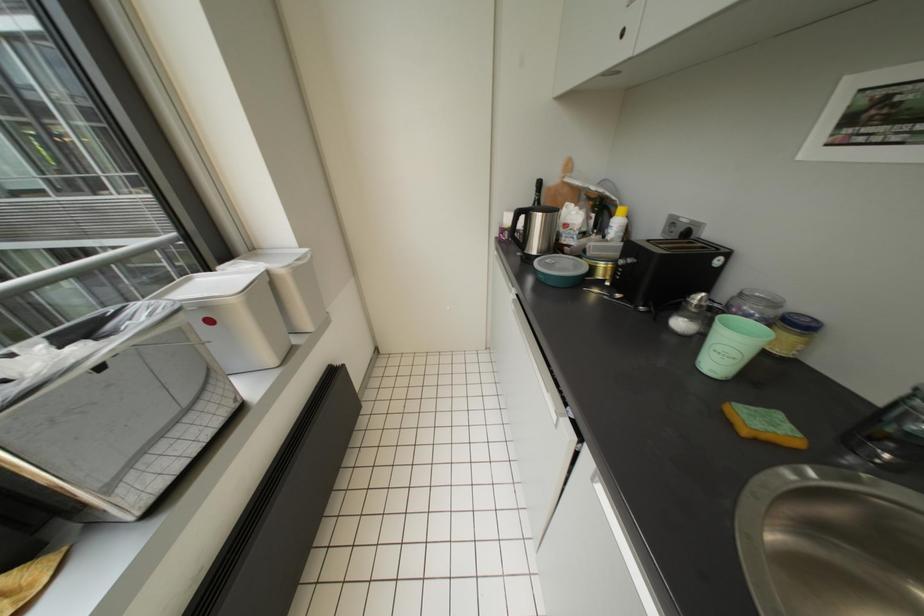
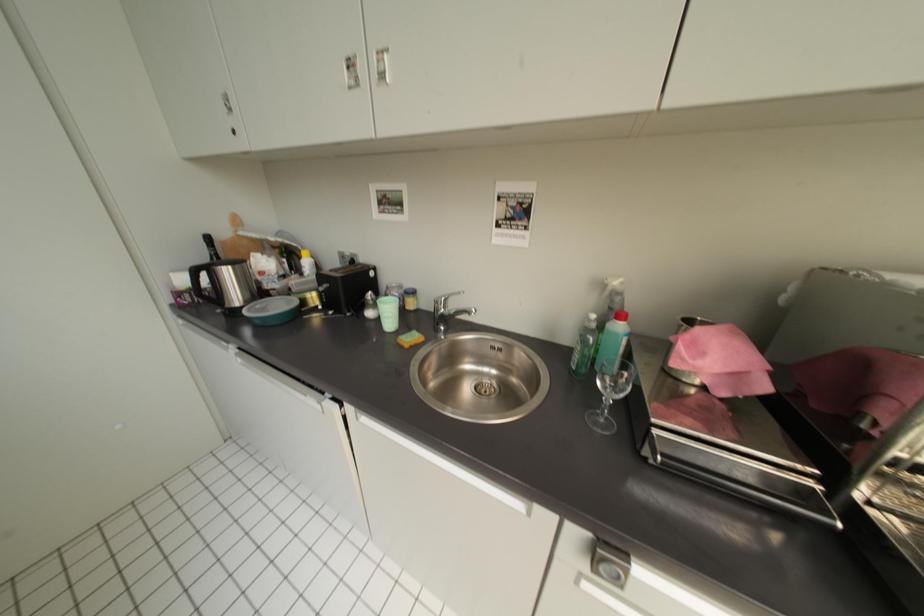
Question: The camera is either moving clockwise (left) or counter-clockwise (right) around the object. The first image is from the beginning of the video and the second image is from the end. Is the camera moving left or right when shooting the video?

Choices:
 (A) Left
 (B) Right

Answer: (A)